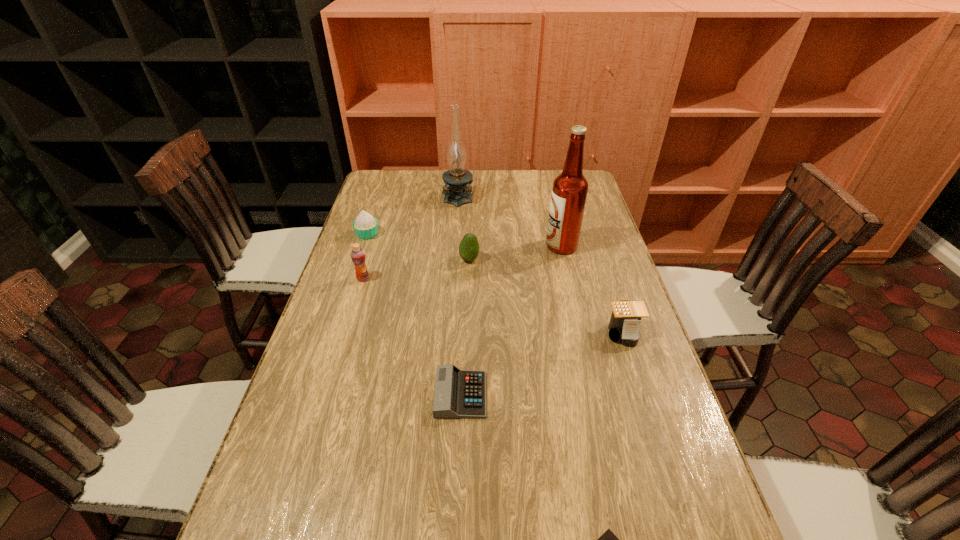
At what (x,y) coordinates should I click in order to perform the action: click on free space located 0.180m on the label side of the alcohol. Please return your answer as a coordinate pair (x, y). This screenshot has height=540, width=960. Looking at the image, I should click on (491, 246).

You are a GUI agent. You are given a task and a screenshot of the screen. Output one action in this format:
    pyautogui.click(x=<x>, y=<y>)
    Task: Click on the vacant position located on the label side of the alcohol
    The image size is (960, 540).
    Given the screenshot: What is the action you would take?
    pyautogui.click(x=471, y=246)

Find the location of a particular element. The image size is (960, 540). free space located on the label side of the alcohol is located at coordinates click(518, 246).

This screenshot has width=960, height=540. I want to click on blank space located on the right of the farthest object, so click(x=523, y=196).

In order to click on free space located on the right of the orange juice in this screenshot , I will do `click(414, 278)`.

The height and width of the screenshot is (540, 960). I want to click on vacant space located on the right of the avocado, so click(505, 259).

At what (x,y) coordinates should I click in order to perform the action: click on free location located on the front of the cupcake. Please return your answer as a coordinate pair (x, y). The width and height of the screenshot is (960, 540). Looking at the image, I should click on (348, 293).

The width and height of the screenshot is (960, 540). I want to click on free point located on the front of the rightmost calculator, so click(x=676, y=493).

Locate an element on the screen. blank space located on the back of the second tallest calculator is located at coordinates (464, 313).

Locate an element on the screen. The image size is (960, 540). object that is at the far edge is located at coordinates (457, 180).